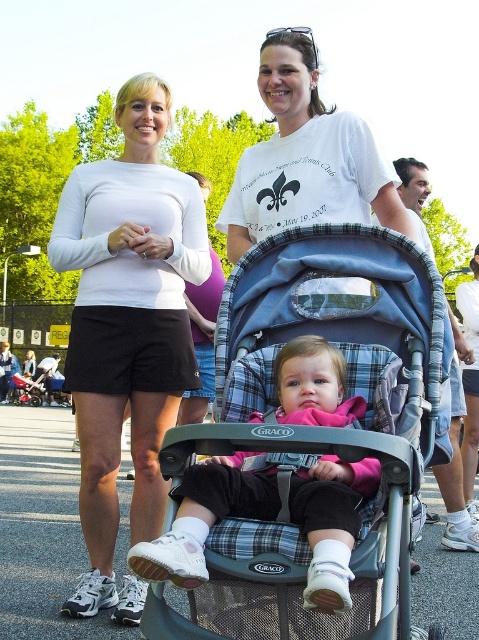
You are standing in the middle of the scene and want to walk towards the two points marked in the image. Which point, point (392, 316) or point (167, 352), will you reach first?

Point (392, 316) is closer to the viewer than point (167, 352), so you will reach point (392, 316) first.